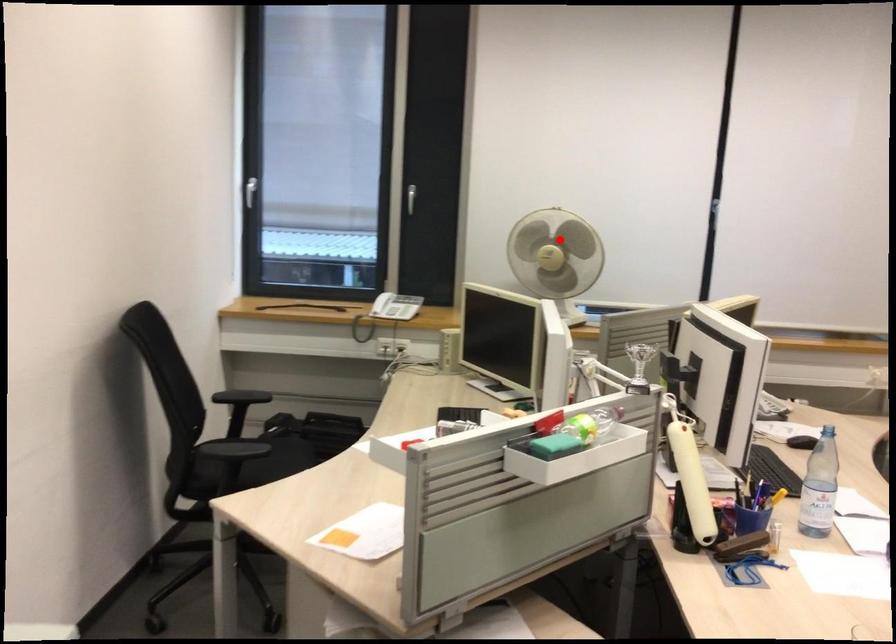
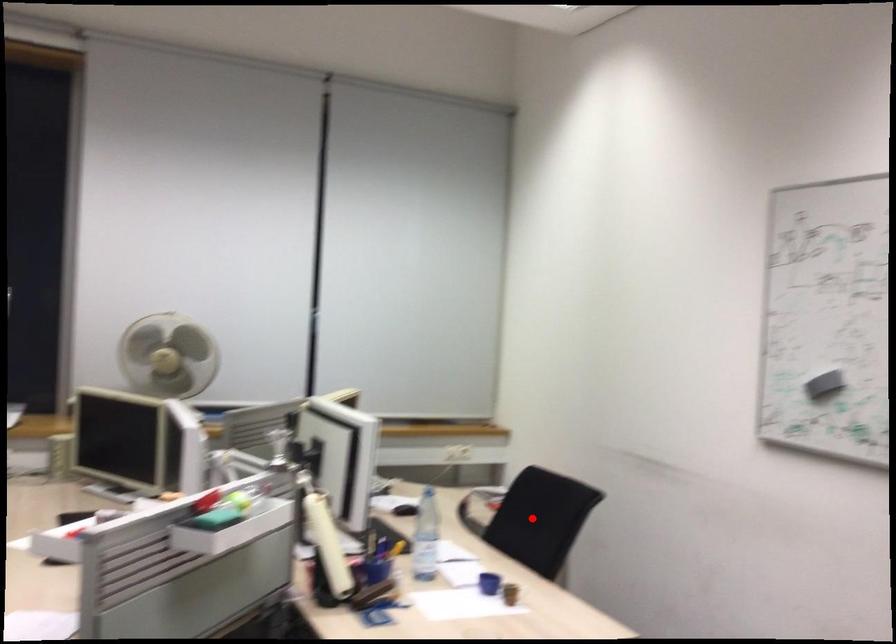
I am providing you with two images of the same scene from different viewpoints. A red point is marked on the first image and another point is marked on the second image. Does the point marked in image1 correspond to the same location as the one in image2?

No